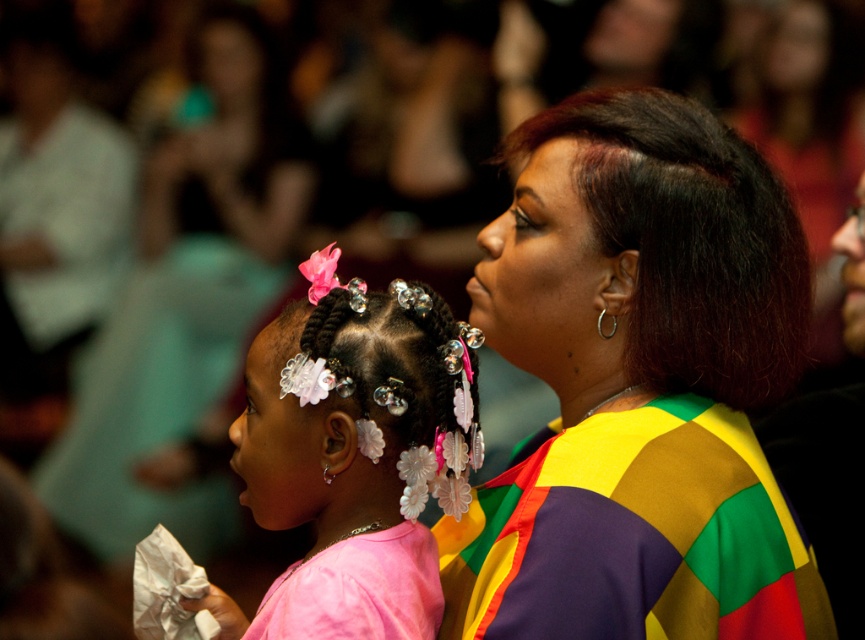
Looking at this image, you are standing in the scene and want to hand a small item to the multicolored fabric at center. Which direction should you move to reach it?

The multicolored fabric at center is located at point (638,387), so you should move towards the lower right direction to reach it.

In the scene shown: You are a fashion designer observing the scene. You notice the multicolored fabric at center and the pink fabric at center. Which fabric has a greater width?

The multicolored fabric at center has a greater width than the pink fabric at center.

You are standing in the scene and want to hand an item to the multicolored fabric at center. To do this, should you move closer to the woman or the young girl?

The multicolored fabric at center is located at point (638, 387), so you should move closer to the young girl since she is positioned in front of the woman and the fabric is likely near her.